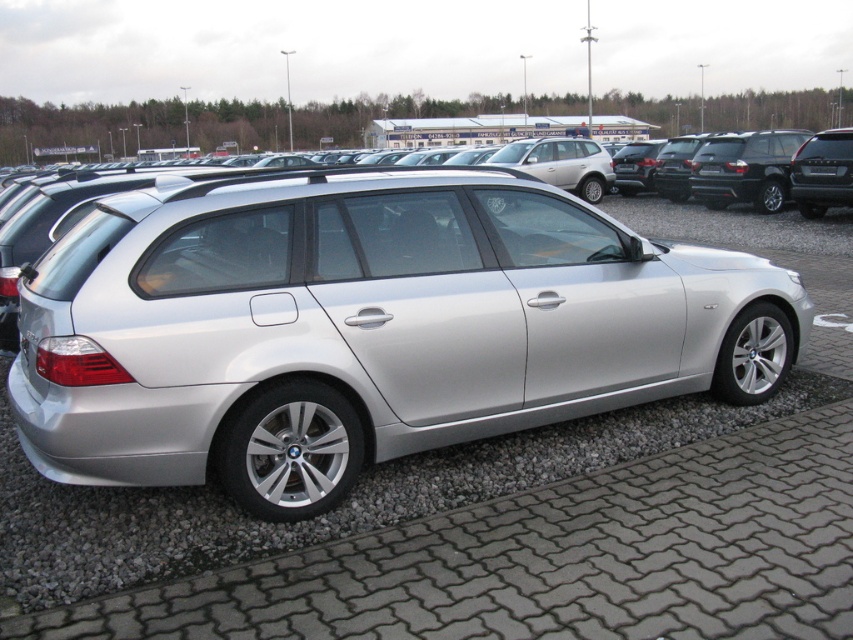
Question: Is satin silver car at center bigger than black plastic license plate at center?

Choices:
 (A) no
 (B) yes

Answer: (B)

Question: Which of the following is the farthest from the observer?

Choices:
 (A) black plastic license plate at center
 (B) satin silver car at center
 (C) satin black suv at upper right

Answer: (A)

Question: Among these objects, which one is farthest from the camera?

Choices:
 (A) satin black suv at upper right
 (B) satin silver car at center
 (C) black plastic license plate at center

Answer: (C)

Question: Is satin silver car at center to the right of black plastic license plate at center from the viewer's perspective?

Choices:
 (A) no
 (B) yes

Answer: (A)

Question: Which object is positioned closest to the black plastic license plate at center?

Choices:
 (A) satin black suv at upper right
 (B) satin silver car at center

Answer: (A)

Question: Can you confirm if satin silver car at center is positioned to the right of black plastic license plate at center?

Choices:
 (A) yes
 (B) no

Answer: (B)